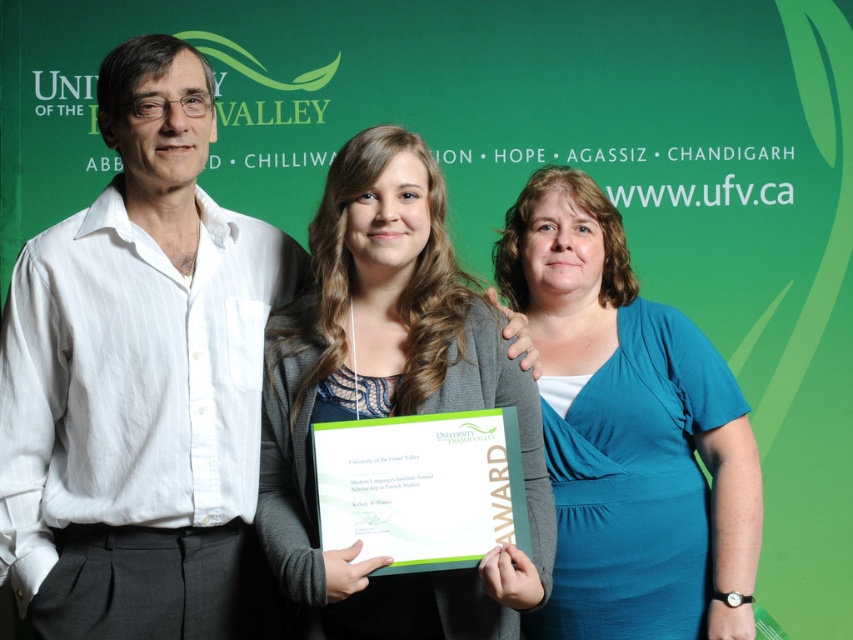
Based on the scene described, can you determine if the white cotton shirt at left is wider than the blue jersey at center?

The white cotton shirt at left might be wider than blue jersey at center according to the description provided.